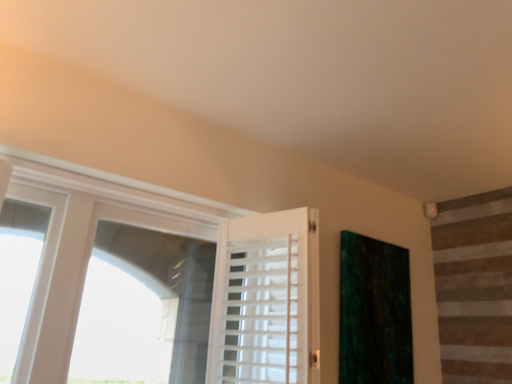
Identify the location of green velvet curtain at right. (374, 312).

What do you see at coordinates (374, 312) in the screenshot?
I see `green velvet curtain at right` at bounding box center [374, 312].

This screenshot has height=384, width=512. Describe the element at coordinates (266, 300) in the screenshot. I see `white wood barn door at center` at that location.

In order to face white wood barn door at center, should I rotate leftwards or rightwards?

You should rotate right by 2.843 degrees.

Measure the distance between white wood barn door at center and camera.

The depth of white wood barn door at center is 4.77 feet.

Where is `white wood barn door at center`? white wood barn door at center is located at coordinates (266, 300).

This screenshot has width=512, height=384. In order to click on green velvet curtain at right in this screenshot , I will do `click(374, 312)`.

Is white wood barn door at center to the left of green velvet curtain at right from the viewer's perspective?

Correct, you'll find white wood barn door at center to the left of green velvet curtain at right.

Looking at this image, does white wood barn door at center come behind green velvet curtain at right?

That is False.

Which is behind, point (237, 379) or point (348, 355)?

Positioned behind is point (348, 355).

From the image's perspective, is white wood barn door at center above or below green velvet curtain at right?

white wood barn door at center is situated higher than green velvet curtain at right in the image.

From a real-world perspective, is white wood barn door at center over green velvet curtain at right?

Incorrect, from a real-world perspective, white wood barn door at center is lower than green velvet curtain at right.

Can you confirm if white wood barn door at center is wider than green velvet curtain at right?

Indeed, white wood barn door at center has a greater width compared to green velvet curtain at right.

Is white wood barn door at center taller or shorter than green velvet curtain at right?

Considering their sizes, white wood barn door at center has less height than green velvet curtain at right.

Does white wood barn door at center have a smaller size compared to green velvet curtain at right?

Actually, white wood barn door at center might be larger than green velvet curtain at right.

Looking at this image, is green velvet curtain at right located within white wood barn door at center?

No.

Is there a large distance between white wood barn door at center and green velvet curtain at right?

Actually, white wood barn door at center and green velvet curtain at right are a little close together.

Is green velvet curtain at right at the back of white wood barn door at center?

Absolutely, white wood barn door at center is directed away from green velvet curtain at right.

At what (x,y) coordinates should I click in order to perform the action: click on barn door that appears in front of the green velvet curtain at right. Please return your answer as a coordinate pair (x, y). The height and width of the screenshot is (384, 512). Looking at the image, I should click on tap(266, 300).

Would you say green velvet curtain at right is to the left or to the right of white wood barn door at center in the picture?

Clearly, green velvet curtain at right is on the right of white wood barn door at center in the image.

Considering the positions of objects green velvet curtain at right and white wood barn door at center in the image provided, who is behind, green velvet curtain at right or white wood barn door at center?

green velvet curtain at right is behind.

Is point (399, 340) closer or farther from the camera than point (267, 279)?

Point (399, 340) is positioned farther from the camera compared to point (267, 279).

From the image's perspective, is green velvet curtain at right beneath white wood barn door at center?

Indeed, from the image's perspective, green velvet curtain at right is shown beneath white wood barn door at center.

From a real-world perspective, is green velvet curtain at right located higher than white wood barn door at center?

Yes, from a real-world perspective, green velvet curtain at right is over white wood barn door at center

Looking at their sizes, would you say green velvet curtain at right is wider or thinner than white wood barn door at center?

Considering their sizes, green velvet curtain at right looks slimmer than white wood barn door at center.

Looking at this image, between green velvet curtain at right and white wood barn door at center, which one has more height?

With more height is green velvet curtain at right.

Which of these two, green velvet curtain at right or white wood barn door at center, is smaller?

green velvet curtain at right.

Do you think green velvet curtain at right is within white wood barn door at center, or outside of it?

The correct answer is: outside.

Is green velvet curtain at right not near white wood barn door at center?

green velvet curtain at right is actually quite close to white wood barn door at center.

Could you tell me if green velvet curtain at right is turned towards white wood barn door at center?

No, green velvet curtain at right does not turn towards white wood barn door at center.

Can you tell me how much green velvet curtain at right and white wood barn door at center differ in facing direction?

The facing directions of green velvet curtain at right and white wood barn door at center are 73.5 degrees apart.

How far apart are green velvet curtain at right and white wood barn door at center?

A distance of 22.22 inches exists between green velvet curtain at right and white wood barn door at center.

Find the location of a particular element. The image size is (512, 384). barn door lying above the green velvet curtain at right (from the image's perspective) is located at coordinates (266, 300).

Locate an element on the screen. curtain above the white wood barn door at center (from a real-world perspective) is located at coordinates (374, 312).

At what (x,y) coordinates should I click in order to perform the action: click on barn door that appears below the green velvet curtain at right (from a real-world perspective). Please return your answer as a coordinate pair (x, y). This screenshot has height=384, width=512. Looking at the image, I should click on (266, 300).